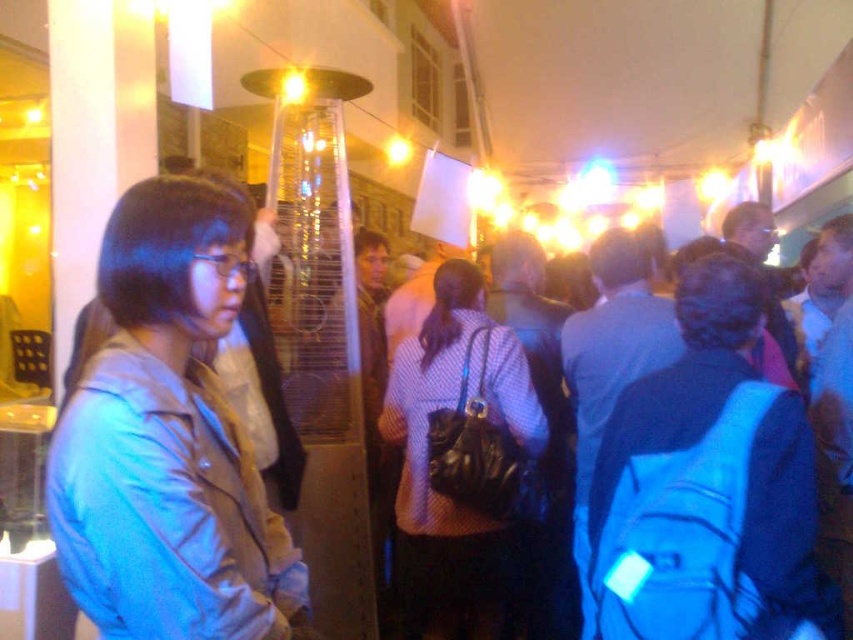
Question: Is matte gray jacket at left positioned behind polka dot shirt at center?

Choices:
 (A) no
 (B) yes

Answer: (A)

Question: Which object appears closest to the camera in this image?

Choices:
 (A) polka dot shirt at center
 (B) matte gray jacket at left

Answer: (B)

Question: Does matte gray jacket at left have a larger size compared to polka dot shirt at center?

Choices:
 (A) yes
 (B) no

Answer: (B)

Question: Is matte gray jacket at left in front of polka dot shirt at center?

Choices:
 (A) yes
 (B) no

Answer: (A)

Question: Which object is closer to the camera taking this photo?

Choices:
 (A) polka dot shirt at center
 (B) matte gray jacket at left

Answer: (B)